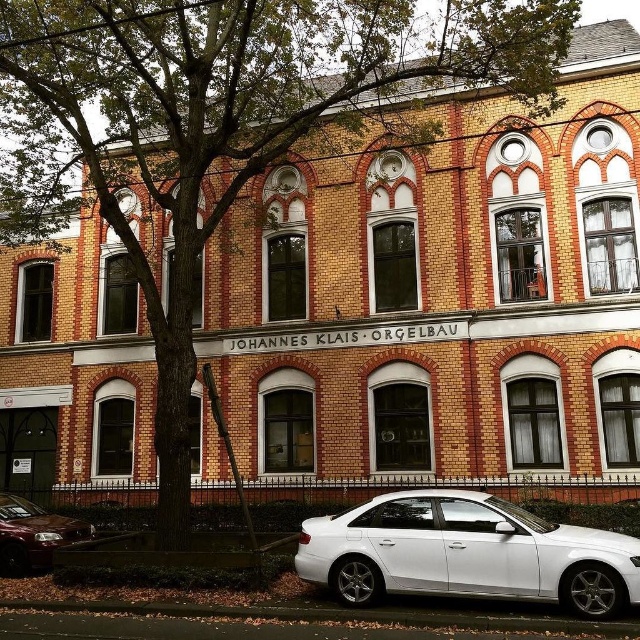
Question: Which of these objects is positioned farthest from the gray concrete curb at lower center?

Choices:
 (A) white glossy sedan at lower right
 (B) shiny red sedan at lower left

Answer: (B)

Question: Which object is closer to the camera taking this photo?

Choices:
 (A) shiny red sedan at lower left
 (B) white glossy sedan at lower right

Answer: (B)

Question: Which point is closer to the camera?

Choices:
 (A) (474, 616)
 (B) (58, 529)
 (C) (461, 522)

Answer: (A)

Question: Is white glossy sedan at lower right below shiny red sedan at lower left?

Choices:
 (A) yes
 (B) no

Answer: (B)

Question: In this image, where is white glossy sedan at lower right located relative to shiny red sedan at lower left?

Choices:
 (A) above
 (B) below

Answer: (A)

Question: Does white glossy sedan at lower right have a lesser width compared to gray concrete curb at lower center?

Choices:
 (A) yes
 (B) no

Answer: (A)